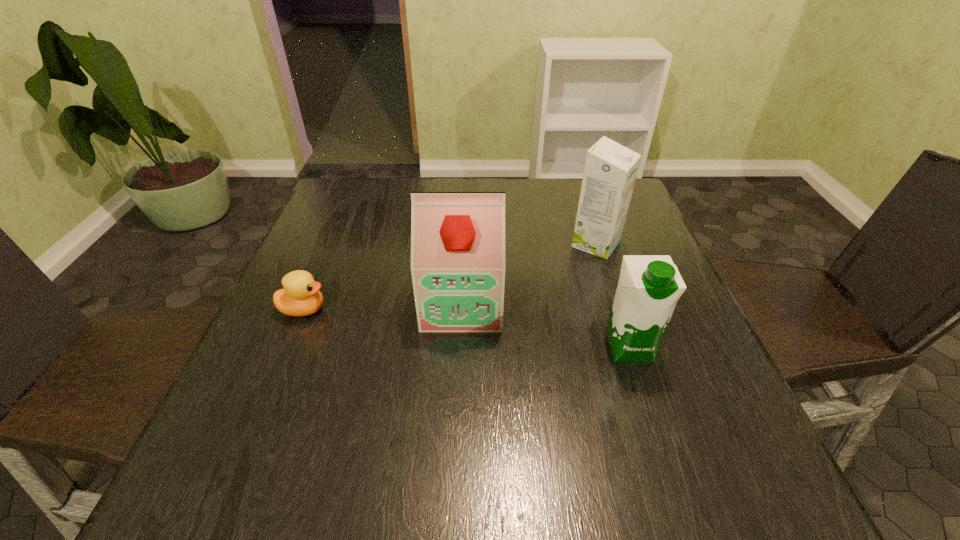
The image size is (960, 540). I want to click on vacant region between the shorter soya milk and the farthest object, so click(612, 295).

The image size is (960, 540). I want to click on empty space that is in between the right soya milk and the taller soya milk, so click(x=545, y=325).

In order to click on free area in between the third object from right to left and the duckling in this screenshot , I will do `click(383, 306)`.

Image resolution: width=960 pixels, height=540 pixels. Find the location of `object that is the third nearest to the carton`. object that is the third nearest to the carton is located at coordinates (x=300, y=297).

I want to click on object that is the closest to the carton, so click(x=457, y=238).

Where is `free space that satisfies the following two spatial constraints: 1. with the cap open on the left soya milk; 2. on the face of the leftmost object`? free space that satisfies the following two spatial constraints: 1. with the cap open on the left soya milk; 2. on the face of the leftmost object is located at coordinates (462, 310).

Identify the location of free space that satisfies the following two spatial constraints: 1. with the cap open on the taller soya milk; 2. on the face of the shortest object. This screenshot has height=540, width=960. (462, 310).